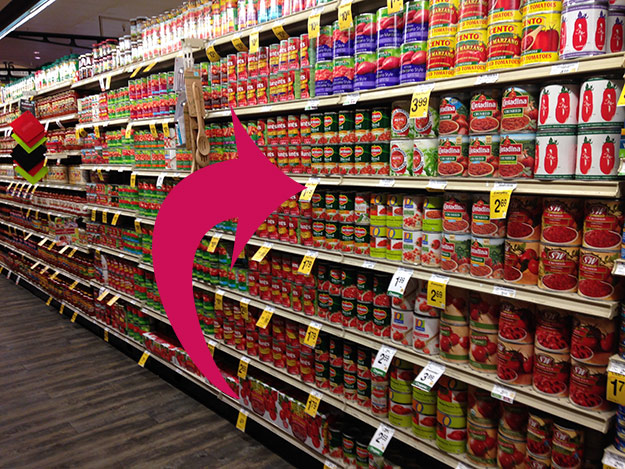
You are a GUI agent. You are given a task and a screenshot of the screen. Output one action in this format:
    pyautogui.click(x=<x>, y=<y>)
    Task: Click on the red cloths hanging on rack in front of long shelf
    The image size is (625, 469).
    Given the screenshot: What is the action you would take?
    pyautogui.click(x=27, y=122), pyautogui.click(x=32, y=139)